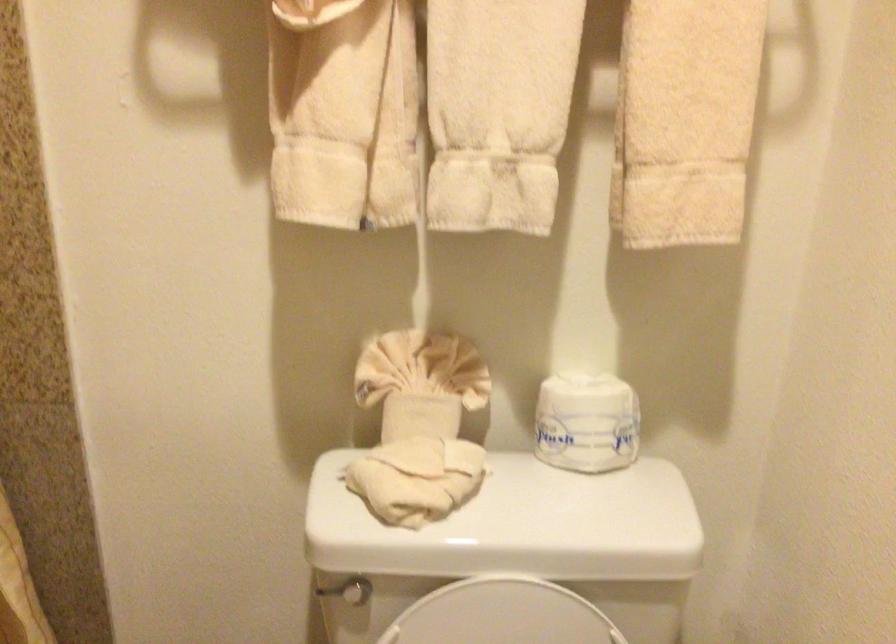
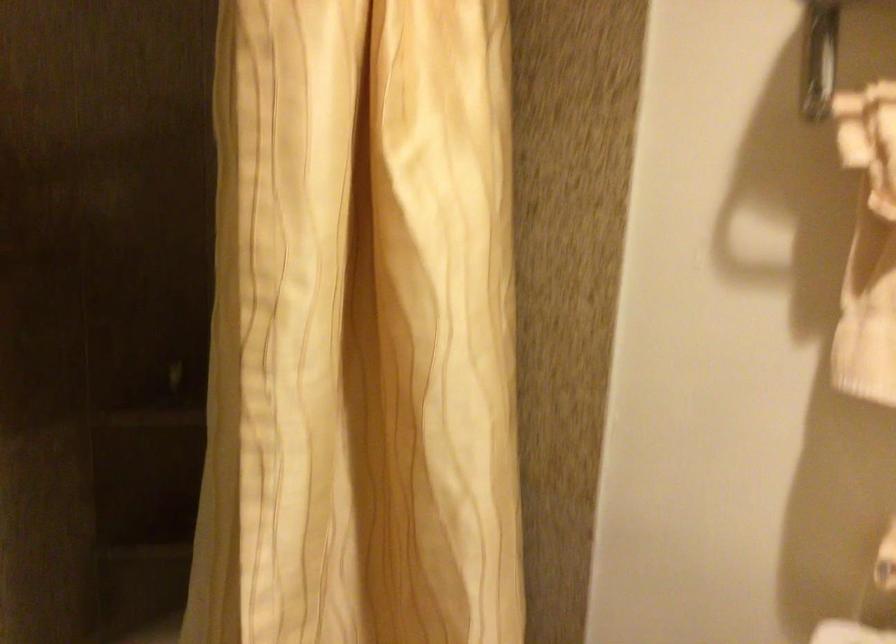
Question: How did the camera likely rotate?

Choices:
 (A) Left
 (B) Right
 (C) Up
 (D) Down

Answer: (A)